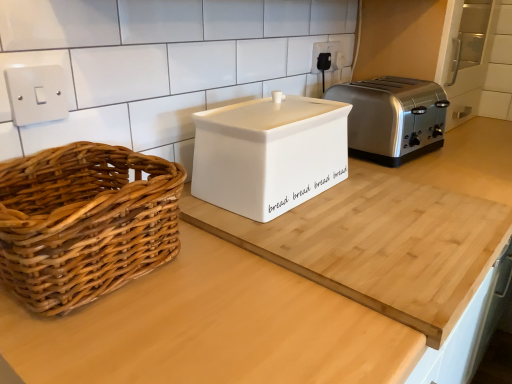
At what (x,y) coordinates should I click in order to perform the action: click on vacant space to the right of white ceramic bread bin at center. Please return your answer as a coordinate pair (x, y). Looking at the image, I should click on (409, 203).